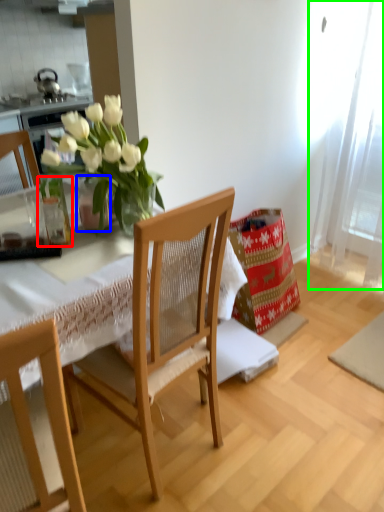
Question: Which object is positioned closest to glass vase (highlighted by a red box)? Select from vase (highlighted by a blue box) and curtain (highlighted by a green box).

Choices:
 (A) vase
 (B) curtain

Answer: (A)